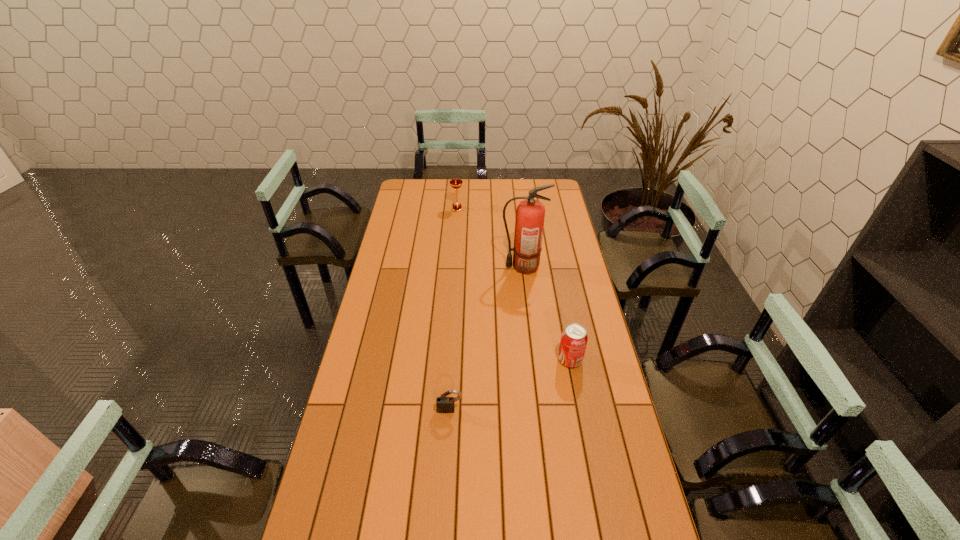
Where is `vacant point located between the shortest object and the chalice`? The image size is (960, 540). vacant point located between the shortest object and the chalice is located at coordinates (454, 309).

This screenshot has height=540, width=960. I want to click on free space between the third farthest object and the shortest object, so click(510, 385).

Image resolution: width=960 pixels, height=540 pixels. In order to click on unoccupied position between the soda and the chalice in this screenshot , I will do `click(514, 284)`.

Find the location of a particular element. This screenshot has height=540, width=960. free point between the second nearest object and the nearest object is located at coordinates (510, 385).

At what (x,y) coordinates should I click in order to perform the action: click on free space between the third nearest object and the third farthest object. Please return your answer as a coordinate pair (x, y). Looking at the image, I should click on (546, 313).

Find the location of a particular element. The width and height of the screenshot is (960, 540). unoccupied position between the chalice and the nearest object is located at coordinates (454, 309).

In order to click on free area in between the second nearest object and the nearest object in this screenshot , I will do `click(510, 385)`.

This screenshot has height=540, width=960. I want to click on empty space between the third farthest object and the chalice, so click(x=514, y=284).

This screenshot has width=960, height=540. In order to click on vacant area that lies between the shortest object and the tallest object in this screenshot , I will do (487, 338).

Identify which object is located as the second nearest to the soda. Please provide its 2D coordinates. Your answer should be formatted as a tuple, i.e. [(x, y)], where the tuple contains the x and y coordinates of a point satisfying the conditions above.

[(529, 222)]